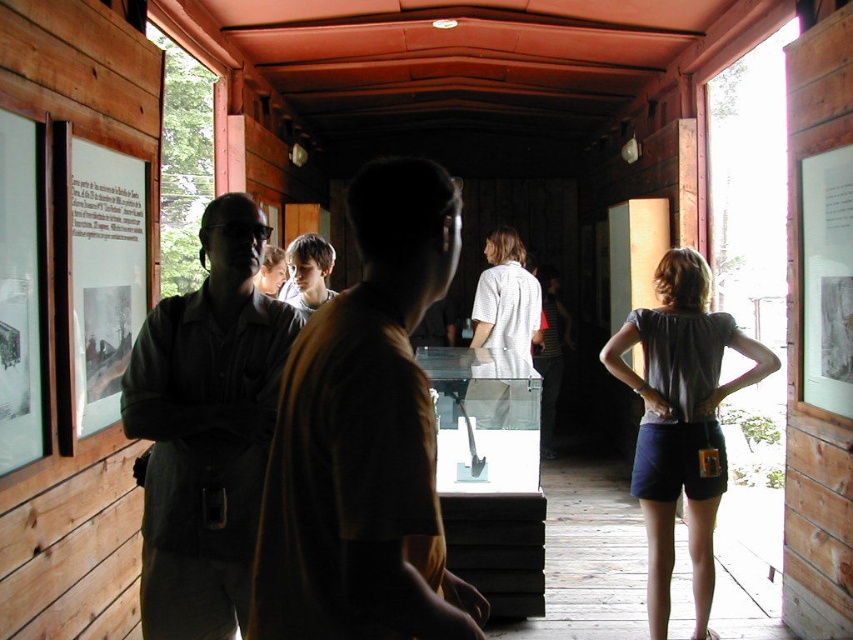
Question: Considering the real-world distances, which object is closest to the matte black shirt at center?

Choices:
 (A) white matte shirt at center
 (B) gray cotton shirt at right
 (C) light brown hair at center

Answer: (C)

Question: Is gray cotton shirt at right bigger than light brown hair at center?

Choices:
 (A) yes
 (B) no

Answer: (A)

Question: Does brown shirt at center lie behind light brown hair at center?

Choices:
 (A) no
 (B) yes

Answer: (A)

Question: Does brown shirt at center have a greater width compared to white matte shirt at center?

Choices:
 (A) yes
 (B) no

Answer: (B)

Question: Which object is farther from the camera taking this photo?

Choices:
 (A) matte black shirt at center
 (B) white matte shirt at center

Answer: (A)

Question: Which of the following is the farthest from the observer?

Choices:
 (A) (422, 611)
 (B) (276, 284)
 (C) (198, 624)

Answer: (B)